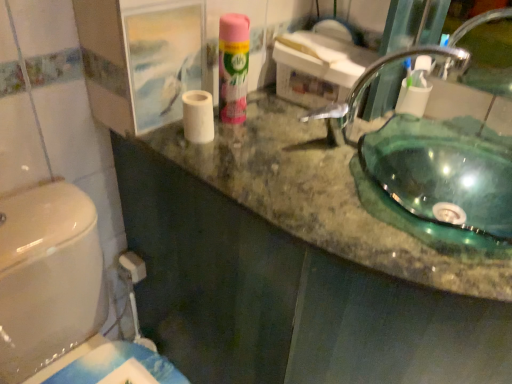
Question: Is pink matte air freshener at upper center taller than white matte toilet paper at upper right, which is the 1th toilet paper from right to left?

Choices:
 (A) yes
 (B) no

Answer: (A)

Question: Considering the relative sizes of pink matte air freshener at upper center and white matte toilet paper at upper right, which is the 1th toilet paper from right to left, in the image provided, is pink matte air freshener at upper center wider than white matte toilet paper at upper right, which is the 1th toilet paper from right to left,?

Choices:
 (A) no
 (B) yes

Answer: (B)

Question: Considering the relative positions of pink matte air freshener at upper center and white matte toilet paper at upper right, which is the 1th toilet paper from right to left, in the image provided, is pink matte air freshener at upper center to the right of white matte toilet paper at upper right, which is the 1th toilet paper from right to left, from the viewer's perspective?

Choices:
 (A) no
 (B) yes

Answer: (A)

Question: Is pink matte air freshener at upper center surrounding white matte toilet paper at upper right, which is the 1th toilet paper from right to left?

Choices:
 (A) no
 (B) yes

Answer: (A)

Question: Considering the relative sizes of pink matte air freshener at upper center and white matte toilet paper at upper right, arranged as the 2th toilet paper when viewed from the front, in the image provided, is pink matte air freshener at upper center bigger than white matte toilet paper at upper right, arranged as the 2th toilet paper when viewed from the front,?

Choices:
 (A) yes
 (B) no

Answer: (A)

Question: In the image, is transparent glass sink at upper right positioned in front of or behind green marble counter top at center?

Choices:
 (A) behind
 (B) front

Answer: (A)

Question: Looking at the image, does transparent glass sink at upper right seem bigger or smaller compared to green marble counter top at center?

Choices:
 (A) big
 (B) small

Answer: (B)

Question: In terms of height, does transparent glass sink at upper right look taller or shorter compared to green marble counter top at center?

Choices:
 (A) short
 (B) tall

Answer: (A)

Question: From the image's perspective, is transparent glass sink at upper right located above or below green marble counter top at center?

Choices:
 (A) above
 (B) below

Answer: (A)

Question: Would you say white matte toilet paper at upper right, positioned as the second toilet paper in left-to-right order, is to the left or to the right of green marble counter top at center in the picture?

Choices:
 (A) right
 (B) left

Answer: (A)

Question: Is point [x=397, y=99] closer or farther from the camera than point [x=348, y=148]?

Choices:
 (A) farther
 (B) closer

Answer: (A)

Question: From the image's perspective, is white matte toilet paper at upper right, positioned as the second toilet paper in left-to-right order, positioned above or below green marble counter top at center?

Choices:
 (A) above
 (B) below

Answer: (A)

Question: In the image, is white matte toilet paper at upper right, positioned as the second toilet paper in left-to-right order, positioned in front of or behind green marble counter top at center?

Choices:
 (A) front
 (B) behind

Answer: (B)

Question: Is green marble counter top at center to the left or to the right of white matte toilet paper at center, the 1th toilet paper from the left, in the image?

Choices:
 (A) right
 (B) left

Answer: (A)

Question: Is point (322, 215) positioned closer to the camera than point (183, 114)?

Choices:
 (A) closer
 (B) farther

Answer: (A)